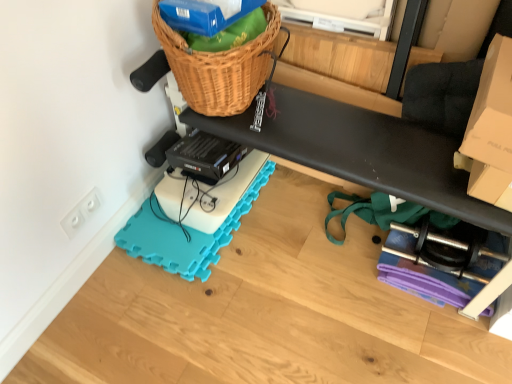
Question: Is white plastic electrical outlet at lower left looking in the opposite direction of woven brown basket at upper center?

Choices:
 (A) no
 (B) yes

Answer: (A)

Question: Is white plastic electrical outlet at lower left far from woven brown basket at upper center?

Choices:
 (A) no
 (B) yes

Answer: (A)

Question: Is white plastic electrical outlet at lower left in front of woven brown basket at upper center?

Choices:
 (A) yes
 (B) no

Answer: (B)

Question: Is white plastic electrical outlet at lower left facing towards woven brown basket at upper center?

Choices:
 (A) no
 (B) yes

Answer: (A)

Question: Does white plastic electrical outlet at lower left appear on the right side of woven brown basket at upper center?

Choices:
 (A) no
 (B) yes

Answer: (A)

Question: Does white plastic electrical outlet at lower left have a greater width compared to woven brown basket at upper center?

Choices:
 (A) no
 (B) yes

Answer: (A)

Question: Does black rubber exercise mat at lower center have a larger size compared to woven brown basket at upper center?

Choices:
 (A) yes
 (B) no

Answer: (A)

Question: From the image's perspective, would you say black rubber exercise mat at lower center is positioned over woven brown basket at upper center?

Choices:
 (A) no
 (B) yes

Answer: (A)

Question: Is black rubber exercise mat at lower center not within woven brown basket at upper center?

Choices:
 (A) yes
 (B) no

Answer: (A)

Question: Does black rubber exercise mat at lower center contain woven brown basket at upper center?

Choices:
 (A) no
 (B) yes

Answer: (A)

Question: Considering the relative sizes of black rubber exercise mat at lower center and woven brown basket at upper center in the image provided, is black rubber exercise mat at lower center wider than woven brown basket at upper center?

Choices:
 (A) no
 (B) yes

Answer: (B)

Question: Considering the relative sizes of black rubber exercise mat at lower center and woven brown basket at upper center in the image provided, is black rubber exercise mat at lower center smaller than woven brown basket at upper center?

Choices:
 (A) yes
 (B) no

Answer: (B)

Question: Is white plastic electrical outlet at lower left to the left of cardboard box at upper right from the viewer's perspective?

Choices:
 (A) no
 (B) yes

Answer: (B)